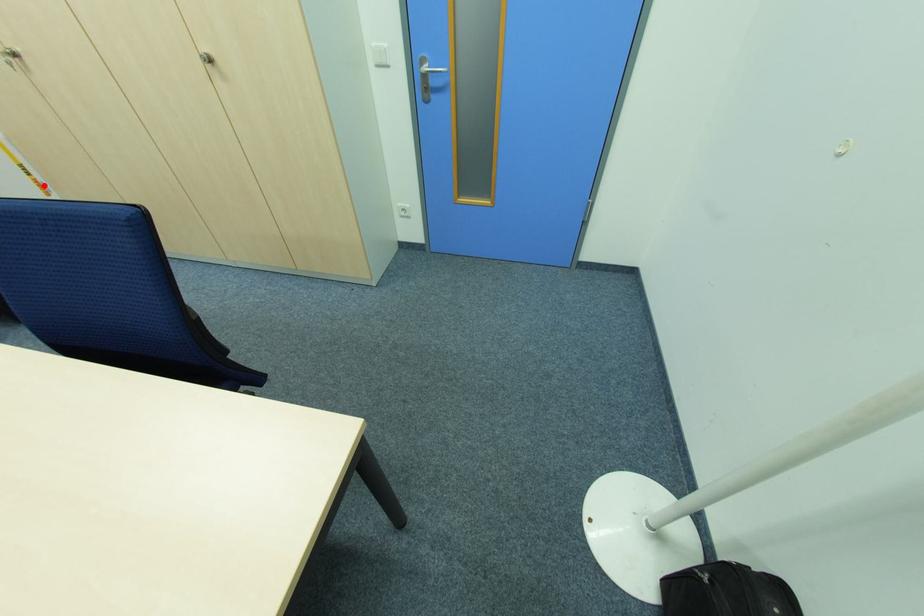
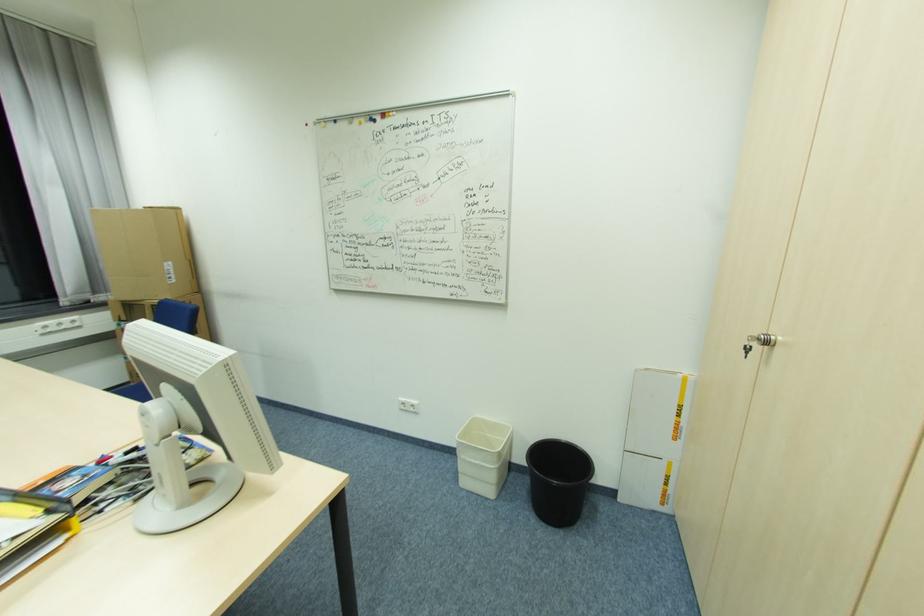
Find the pixel in the second image that matches the highlighted location in the first image.

(681, 430)